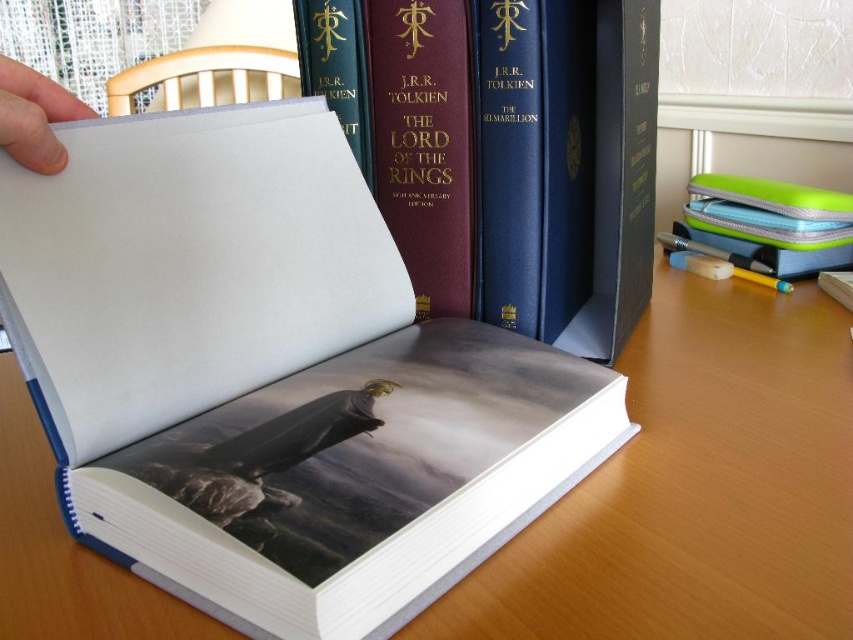
Is wooden table at center to the left of white paper at upper left from the viewer's perspective?

In fact, wooden table at center is to the right of white paper at upper left.

Who is more forward, (30, 634) or (30, 96)?

Point (30, 634)

You are a GUI agent. You are given a task and a screenshot of the screen. Output one action in this format:
    pyautogui.click(x=<x>, y=<y>)
    Task: Click on the wooden table at center
    This screenshot has height=640, width=853.
    Given the screenshot: What is the action you would take?
    pyautogui.click(x=695, y=486)

Does hardcover book at center appear under white paper at upper left?

Incorrect, hardcover book at center is not positioned below white paper at upper left.

Which is behind, point (517, 250) or point (41, 100)?

The point (517, 250) is more distant.

Locate an element on the screen. hardcover book at center is located at coordinates (503, 150).

Who is positioned more to the right, wooden table at center or hardcover book at center?

Positioned to the right is wooden table at center.

Is wooden table at center taller than hardcover book at center?

Incorrect, wooden table at center's height is not larger of hardcover book at center's.

Locate an element on the screen. The width and height of the screenshot is (853, 640). wooden table at center is located at coordinates (695, 486).